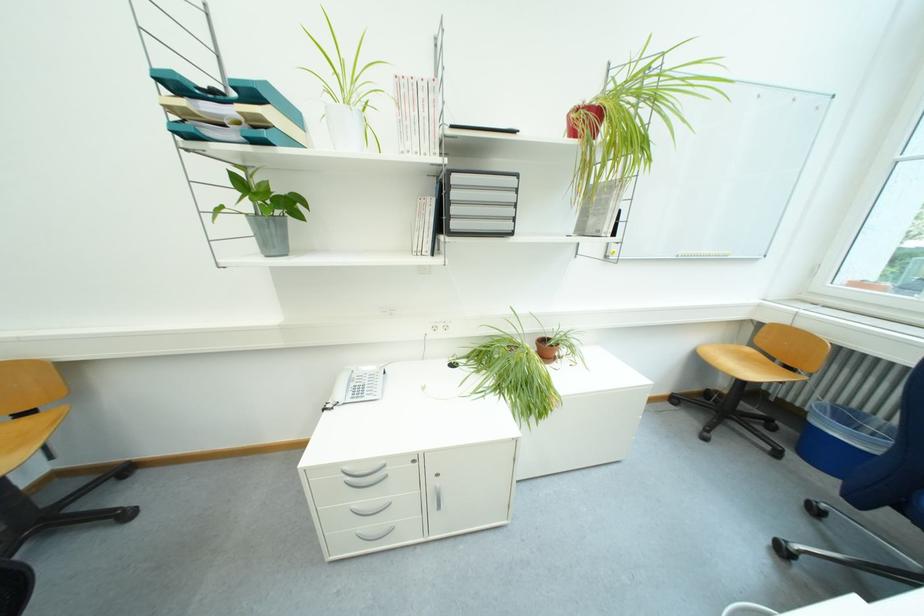
Describe the element at coordinates (703, 254) in the screenshot. Image resolution: width=924 pixels, height=616 pixels. I see `the whiteboard eraser` at that location.